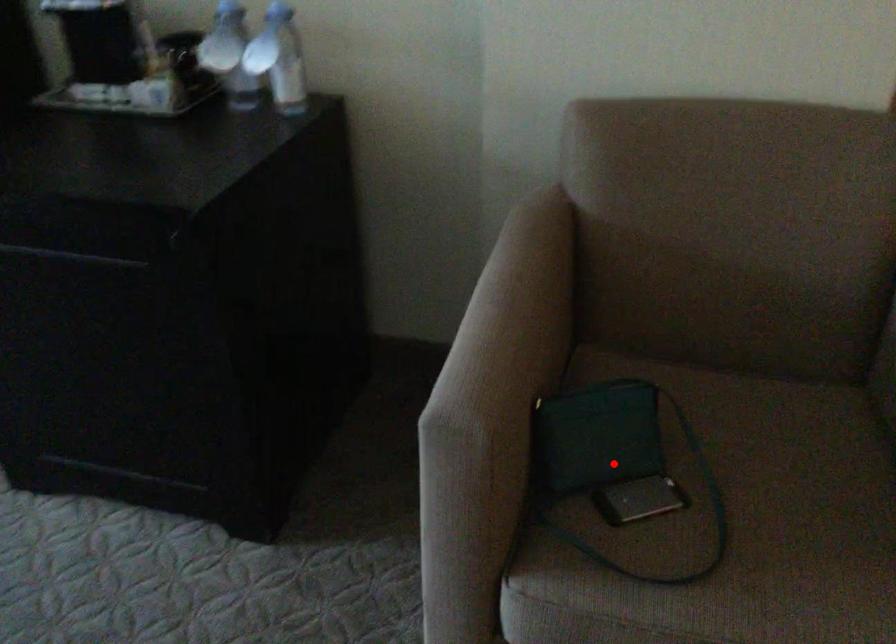
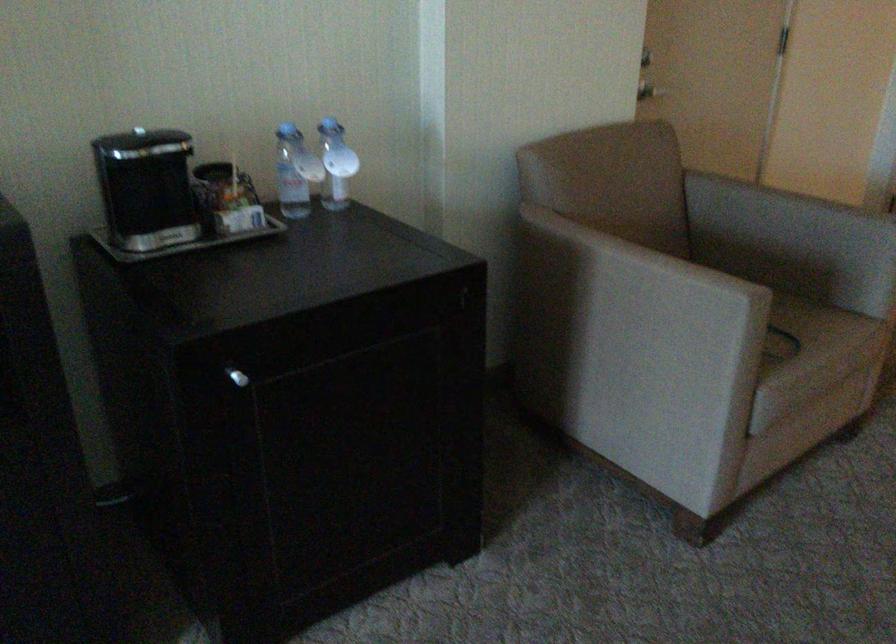
Question: I am providing you with two images of the same scene from different viewpoints. A red point is marked on the first image. Can you still see the location of the red point in image 2?

Choices:
 (A) Yes
 (B) No

Answer: (B)